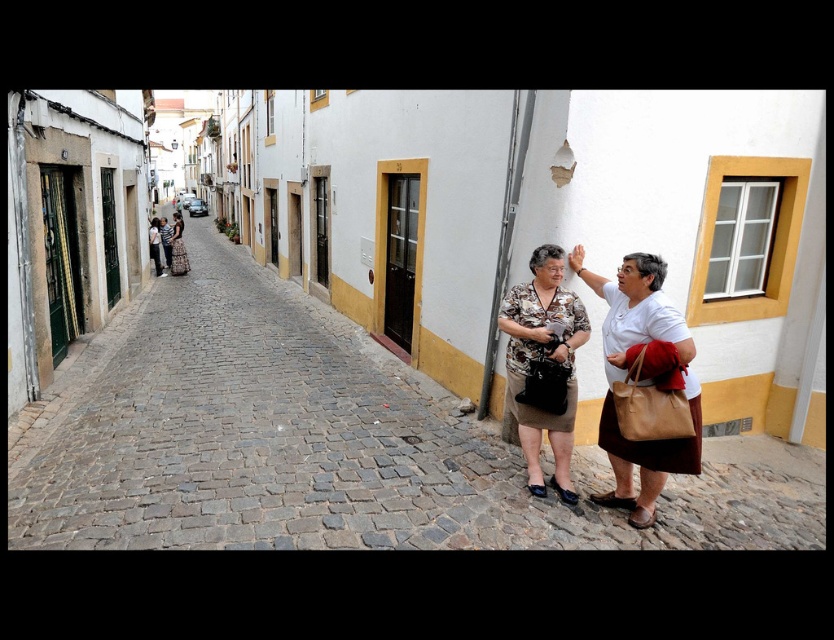
Does brown textured skirt at center appear on the left side of matte black dress at center?

No, brown textured skirt at center is not to the left of matte black dress at center.

Can you confirm if brown textured skirt at center is taller than matte black dress at center?

No, brown textured skirt at center is not taller than matte black dress at center.

Is point (575, 340) closer to camera compared to point (174, 221)?

Yes.

You are a GUI agent. You are given a task and a screenshot of the screen. Output one action in this format:
    pyautogui.click(x=<x>, y=<y>)
    Task: Click on the brown textured skirt at center
    This screenshot has width=834, height=640.
    Given the screenshot: What is the action you would take?
    pyautogui.click(x=543, y=365)

Can you confirm if matte white shirt at center is thinner than brown textured skirt at center?

No.

Who is positioned more to the left, matte white shirt at center or brown textured skirt at center?

Positioned to the left is brown textured skirt at center.

At what (x,y) coordinates should I click in order to perform the action: click on matte white shirt at center. Please return your answer as a coordinate pair (x, y). The width and height of the screenshot is (834, 640). Looking at the image, I should click on (644, 385).

You are a GUI agent. You are given a task and a screenshot of the screen. Output one action in this format:
    pyautogui.click(x=<x>, y=<y>)
    Task: Click on the matte white shirt at center
    
    Given the screenshot: What is the action you would take?
    pyautogui.click(x=644, y=385)

In the scene shown: Is matte white shirt at center smaller than matte black dress at center?

Indeed, matte white shirt at center has a smaller size compared to matte black dress at center.

Can you confirm if matte white shirt at center is positioned to the left of matte black dress at center?

No, matte white shirt at center is not to the left of matte black dress at center.

Is point (606, 404) behind point (179, 264)?

No, it is in front of (179, 264).

Locate an element on the screen. matte white shirt at center is located at coordinates (644, 385).